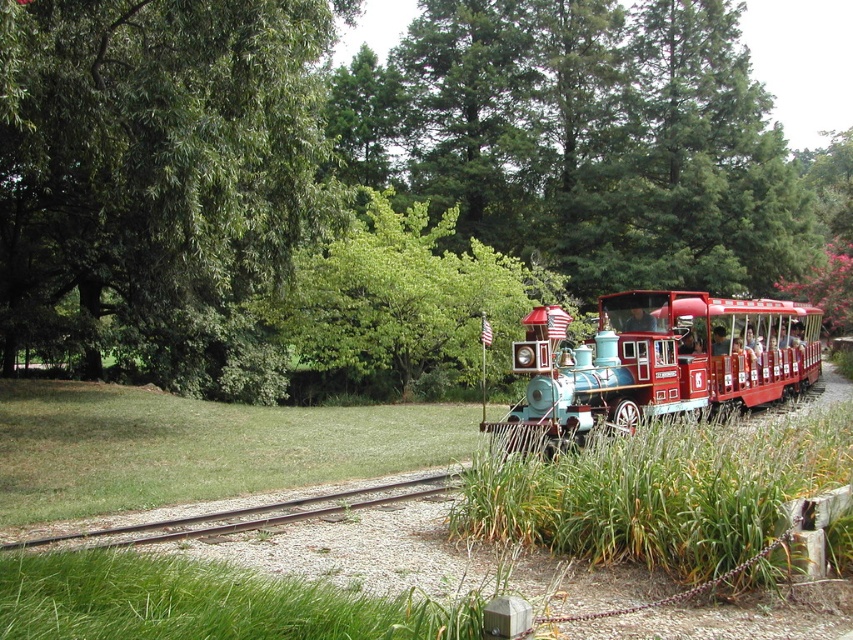
Is green leafy tree at upper left further to camera compared to blue metallic train at center?

Yes.

Is point (108, 332) positioned after point (527, 557)?

Yes.

This screenshot has height=640, width=853. Find the location of `green leafy tree at upper left`. green leafy tree at upper left is located at coordinates (158, 180).

Is point (372, 225) positioned behind point (85, 541)?

Yes.

Does point (405, 211) come closer to viewer compared to point (428, 477)?

No, (405, 211) is behind (428, 477).

You are a GUI agent. You are given a task and a screenshot of the screen. Output one action in this format:
    pyautogui.click(x=<x>, y=<y>)
    Task: Click on the green leafy tree at center
    The width and height of the screenshot is (853, 640).
    Given the screenshot: What is the action you would take?
    pyautogui.click(x=404, y=300)

Where is `green leafy tree at center`? The height and width of the screenshot is (640, 853). green leafy tree at center is located at coordinates (404, 300).

Who is more distant from viewer, (433,387) or (553,440)?

The point (433,387) is behind.

Does green leafy tree at center appear under shiny red train at right?

Actually, green leafy tree at center is above shiny red train at right.

Identify the location of green leafy tree at center. (404, 300).

Where is `green leafy tree at center`? Image resolution: width=853 pixels, height=640 pixels. green leafy tree at center is located at coordinates coord(404,300).